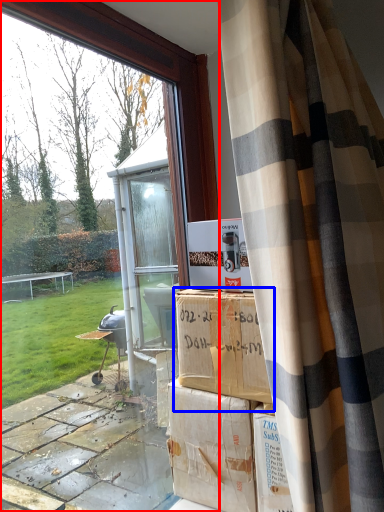
Question: Which object is further to the camera taking this photo, window (highlighted by a red box) or cardboard box (highlighted by a blue box)?

Choices:
 (A) window
 (B) cardboard box

Answer: (B)